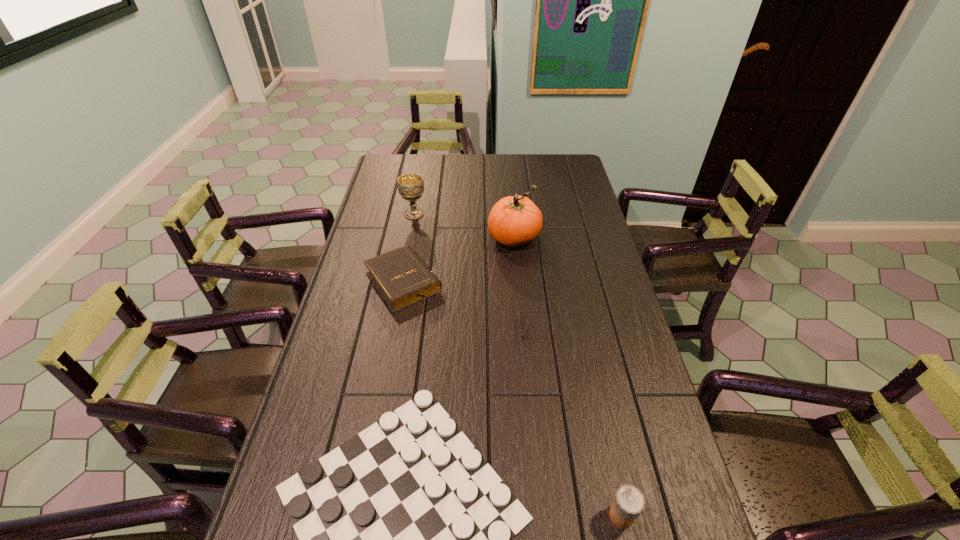
Locate an element on the screen. blank area located on the label side of the rightmost object is located at coordinates (474, 515).

What are the coordinates of `blank area located 0.220m on the label side of the rightmost object` in the screenshot? It's located at (507, 515).

At what (x,y) coordinates should I click in order to perform the action: click on free space located 0.220m on the label side of the rightmost object. Please return your answer as a coordinate pair (x, y). Looking at the image, I should click on (507, 515).

Locate an element on the screen. vacant region located on the back of the fourth tallest object is located at coordinates (417, 211).

Identify the location of free location located on the front-facing side of the sunglasses. (452, 330).

I want to click on free location located 0.190m on the front-facing side of the sunglasses, so click(x=459, y=330).

This screenshot has width=960, height=540. Find the location of `vacant space located on the front-facing side of the sunglasses`. vacant space located on the front-facing side of the sunglasses is located at coordinates (489, 330).

I want to click on chalice that is positioned at the left edge, so click(410, 186).

Image resolution: width=960 pixels, height=540 pixels. I want to click on Bible present at the left edge, so click(x=401, y=277).

You are a GUI agent. You are given a task and a screenshot of the screen. Output one action in this format:
    pyautogui.click(x=<x>, y=<y>)
    Task: Click on the object that is at the right edge
    
    Given the screenshot: What is the action you would take?
    pyautogui.click(x=629, y=502)